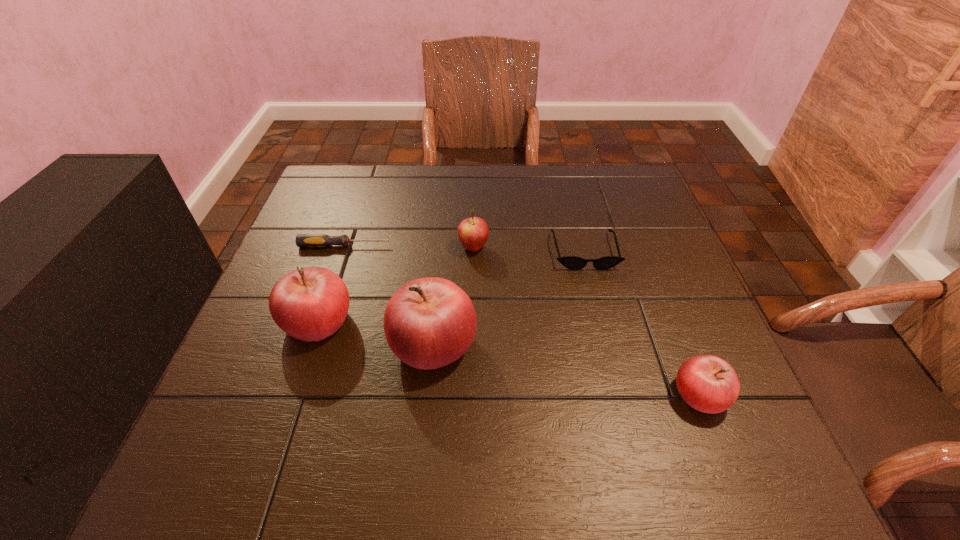
In order to click on vacant space that's between the rightmost apple and the fifth tallest object in this screenshot , I will do `click(642, 323)`.

Where is `empty space between the screwdriver and the second object from right to left`? The width and height of the screenshot is (960, 540). empty space between the screwdriver and the second object from right to left is located at coordinates (465, 248).

Locate an element on the screen. The width and height of the screenshot is (960, 540). object that ranks as the second closest to the sunglasses is located at coordinates (429, 323).

Image resolution: width=960 pixels, height=540 pixels. Find the location of `object that ranks as the second closest to the third shortest apple`. object that ranks as the second closest to the third shortest apple is located at coordinates (302, 240).

The height and width of the screenshot is (540, 960). Identify the location of apple that is the third closest to the shortest object. (429, 323).

Choose which apple is the second nearest neighbor to the rightmost object. Please provide its 2D coordinates. Your answer should be formatted as a tuple, i.e. [(x, y)], where the tuple contains the x and y coordinates of a point satisfying the conditions above.

[(473, 232)]

Locate an element on the screen. free location that satisfies the following two spatial constraints: 1. insert the shortest object into a screw head; 2. on the back side of the fourth tallest object is located at coordinates (296, 395).

Where is `vacant space that satisfies the following two spatial constraints: 1. on the back side of the rightmost object; 2. insert the shortest object into a screw head`? vacant space that satisfies the following two spatial constraints: 1. on the back side of the rightmost object; 2. insert the shortest object into a screw head is located at coordinates (641, 246).